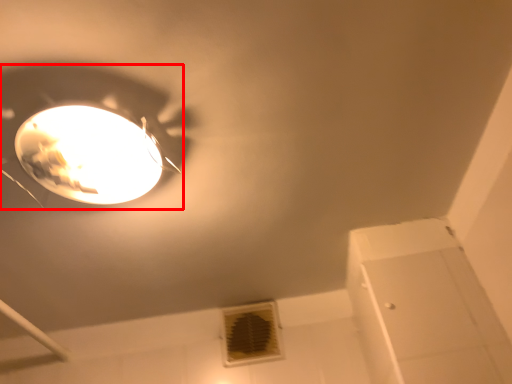
Question: From the image's perspective, considering the relative positions of lamp (annotated by the red box) and air conditioning in the image provided, where is lamp (annotated by the red box) located with respect to the staircase?

Choices:
 (A) above
 (B) below

Answer: (A)